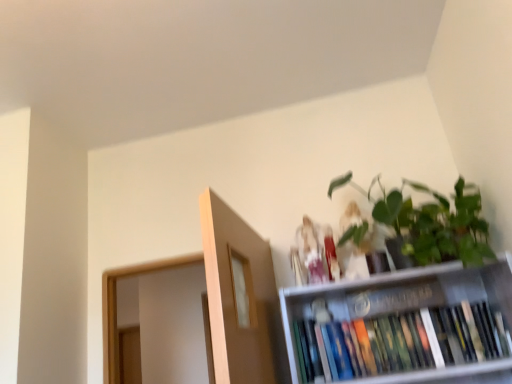
The width and height of the screenshot is (512, 384). What do you see at coordinates (400, 343) in the screenshot? I see `hardcover books at upper right` at bounding box center [400, 343].

Image resolution: width=512 pixels, height=384 pixels. Describe the element at coordinates (355, 257) in the screenshot. I see `matte white figurine at upper center, positioned as the first toy in right-to-left order` at that location.

This screenshot has width=512, height=384. What do you see at coordinates (309, 256) in the screenshot? I see `matte white figurine at upper center, the 1th toy in the left-to-right sequence` at bounding box center [309, 256].

In order to face matte white figurine at upper center, the 1th toy in the left-to-right sequence, should I rotate leftwards or rightwards?

A 7.826 degree turn to the right will do.

The image size is (512, 384). I want to click on hardcover books at upper right, so click(400, 343).

Which object is further away from the camera, green matte plant at upper right or matte white figurine at upper center, the 1th toy in the left-to-right sequence?

matte white figurine at upper center, the 1th toy in the left-to-right sequence.

Does point (464, 189) lie behind point (307, 255)?

No, (464, 189) is in front of (307, 255).

Consider the image. Can you confirm if green matte plant at upper right is smaller than matte white figurine at upper center, which appears as the 2th toy when viewed from the right?

Actually, green matte plant at upper right might be larger than matte white figurine at upper center, which appears as the 2th toy when viewed from the right.

Which of these two, matte white figurine at upper center, which ranks as the 2th toy in left-to-right order, or matte white figurine at upper center, the 1th toy in the left-to-right sequence, is smaller?

Smaller between the two is matte white figurine at upper center, the 1th toy in the left-to-right sequence.

From the image's perspective, does matte white figurine at upper center, positioned as the first toy in right-to-left order, appear lower than matte white figurine at upper center, the 1th toy in the left-to-right sequence?

Actually, matte white figurine at upper center, positioned as the first toy in right-to-left order, appears above matte white figurine at upper center, the 1th toy in the left-to-right sequence, in the image.

Measure the distance between matte white figurine at upper center, which ranks as the 2th toy in left-to-right order, and matte white figurine at upper center, the 1th toy in the left-to-right sequence.

matte white figurine at upper center, which ranks as the 2th toy in left-to-right order, is 5.88 inches away from matte white figurine at upper center, the 1th toy in the left-to-right sequence.

Looking at this image, who is more distant, matte white figurine at upper center, positioned as the first toy in right-to-left order, or matte white figurine at upper center, which appears as the 2th toy when viewed from the right?

matte white figurine at upper center, which appears as the 2th toy when viewed from the right, is further away from the camera.

How distant is hardcover books at upper right from matte white figurine at upper center, which ranks as the 2th toy in left-to-right order?

They are 34.64 centimeters apart.

Can you confirm if hardcover books at upper right is thinner than matte white figurine at upper center, positioned as the first toy in right-to-left order?

Yes, hardcover books at upper right is thinner than matte white figurine at upper center, positioned as the first toy in right-to-left order.

Is the position of hardcover books at upper right less distant than that of matte white figurine at upper center, which ranks as the 2th toy in left-to-right order?

Yes, hardcover books at upper right is closer to the camera.

Considering the relative positions of hardcover books at upper right and matte white figurine at upper center, positioned as the first toy in right-to-left order, in the image provided, is hardcover books at upper right to the left of matte white figurine at upper center, positioned as the first toy in right-to-left order, from the viewer's perspective?

No.

From a real-world perspective, is green matte plant at upper right on hardcover books at upper right?

Correct, in the physical world, green matte plant at upper right is higher than hardcover books at upper right.

Identify the location of book beneath the green matte plant at upper right (from a real-world perspective). (400, 343).

Is green matte plant at upper right smaller than hardcover books at upper right?

Incorrect, green matte plant at upper right is not smaller in size than hardcover books at upper right.

From the image's perspective, does green matte plant at upper right appear lower than hardcover books at upper right?

No, from the image's perspective, green matte plant at upper right is not beneath hardcover books at upper right.

Is hardcover books at upper right aimed at matte white figurine at upper center, the 1th toy in the left-to-right sequence?

No.

Considering the sizes of objects hardcover books at upper right and matte white figurine at upper center, the 1th toy in the left-to-right sequence, in the image provided, who is taller, hardcover books at upper right or matte white figurine at upper center, the 1th toy in the left-to-right sequence,?

Standing taller between the two is matte white figurine at upper center, the 1th toy in the left-to-right sequence.

Would you say hardcover books at upper right is inside or outside matte white figurine at upper center, the 1th toy in the left-to-right sequence?

The correct answer is: outside.

Is matte white figurine at upper center, which ranks as the 2th toy in left-to-right order, to the right of hardcover books at upper right from the viewer's perspective?

In fact, matte white figurine at upper center, which ranks as the 2th toy in left-to-right order, is to the left of hardcover books at upper right.

Considering the positions of objects matte white figurine at upper center, which ranks as the 2th toy in left-to-right order, and hardcover books at upper right in the image provided, who is behind, matte white figurine at upper center, which ranks as the 2th toy in left-to-right order, or hardcover books at upper right?

matte white figurine at upper center, which ranks as the 2th toy in left-to-right order, is further from the camera.

Is matte white figurine at upper center, positioned as the first toy in right-to-left order, spatially inside hardcover books at upper right, or outside of it?

matte white figurine at upper center, positioned as the first toy in right-to-left order, is located beyond the bounds of hardcover books at upper right.

How much distance is there between green matte plant at upper right and matte white figurine at upper center, positioned as the first toy in right-to-left order?

The distance of green matte plant at upper right from matte white figurine at upper center, positioned as the first toy in right-to-left order, is 8.20 inches.

From the image's perspective, which one is positioned lower, green matte plant at upper right or matte white figurine at upper center, positioned as the first toy in right-to-left order?

matte white figurine at upper center, positioned as the first toy in right-to-left order, appears lower in the image.

Are green matte plant at upper right and matte white figurine at upper center, positioned as the first toy in right-to-left order, far apart?

green matte plant at upper right is near matte white figurine at upper center, positioned as the first toy in right-to-left order, not far away.

How different are the orientations of green matte plant at upper right and matte white figurine at upper center, which ranks as the 2th toy in left-to-right order, in degrees?

0.000748 degrees.

Which toy is the 2nd one when counting from the back of the green matte plant at upper right? Please provide its 2D coordinates.

[(309, 256)]

Image resolution: width=512 pixels, height=384 pixels. I want to click on toy above the matte white figurine at upper center, the 1th toy in the left-to-right sequence (from a real-world perspective), so point(355,257).

Estimate the real-world distances between objects in this image. Which object is further from green matte plant at upper right, matte white figurine at upper center, positioned as the first toy in right-to-left order, or matte white figurine at upper center, which appears as the 2th toy when viewed from the right?

Based on the image, matte white figurine at upper center, which appears as the 2th toy when viewed from the right, appears to be further to green matte plant at upper right.

Looking at the image, which one is located closer to matte white figurine at upper center, the 1th toy in the left-to-right sequence, matte white figurine at upper center, positioned as the first toy in right-to-left order, or hardcover books at upper right?

Based on the image, matte white figurine at upper center, positioned as the first toy in right-to-left order, appears to be nearer to matte white figurine at upper center, the 1th toy in the left-to-right sequence.

From the image, which object appears to be nearer to hardcover books at upper right, matte white figurine at upper center, the 1th toy in the left-to-right sequence, or green matte plant at upper right?

matte white figurine at upper center, the 1th toy in the left-to-right sequence.

When comparing their distances from matte white figurine at upper center, positioned as the first toy in right-to-left order, does hardcover books at upper right or matte white figurine at upper center, the 1th toy in the left-to-right sequence, seem closer?

matte white figurine at upper center, the 1th toy in the left-to-right sequence, lies closer to matte white figurine at upper center, positioned as the first toy in right-to-left order, than the other object.

Looking at the image, which one is located further to matte white figurine at upper center, which ranks as the 2th toy in left-to-right order, matte white figurine at upper center, which appears as the 2th toy when viewed from the right, or hardcover books at upper right?

Based on the image, hardcover books at upper right appears to be further to matte white figurine at upper center, which ranks as the 2th toy in left-to-right order.

When comparing their distances from matte white figurine at upper center, the 1th toy in the left-to-right sequence, does matte white figurine at upper center, positioned as the first toy in right-to-left order, or green matte plant at upper right seem further?

green matte plant at upper right is positioned further to the anchor matte white figurine at upper center, the 1th toy in the left-to-right sequence.

Estimate the real-world distances between objects in this image. Which object is closer to hardcover books at upper right, matte white figurine at upper center, positioned as the first toy in right-to-left order, or matte white figurine at upper center, the 1th toy in the left-to-right sequence?

matte white figurine at upper center, positioned as the first toy in right-to-left order, lies closer to hardcover books at upper right than the other object.

In the scene shown: Which object lies nearer to the anchor point matte white figurine at upper center, positioned as the first toy in right-to-left order, green matte plant at upper right or hardcover books at upper right?

The object closer to matte white figurine at upper center, positioned as the first toy in right-to-left order, is green matte plant at upper right.

Image resolution: width=512 pixels, height=384 pixels. I want to click on toy between green matte plant at upper right and matte white figurine at upper center, which appears as the 2th toy when viewed from the right, along the z-axis, so coord(355,257).

This screenshot has width=512, height=384. Find the location of `book between green matte plant at upper right and matte white figurine at upper center, the 1th toy in the left-to-right sequence, from front to back`. book between green matte plant at upper right and matte white figurine at upper center, the 1th toy in the left-to-right sequence, from front to back is located at coordinates (400, 343).

Identify the location of toy between matte white figurine at upper center, positioned as the first toy in right-to-left order, and hardcover books at upper right from top to bottom. This screenshot has width=512, height=384. (309, 256).